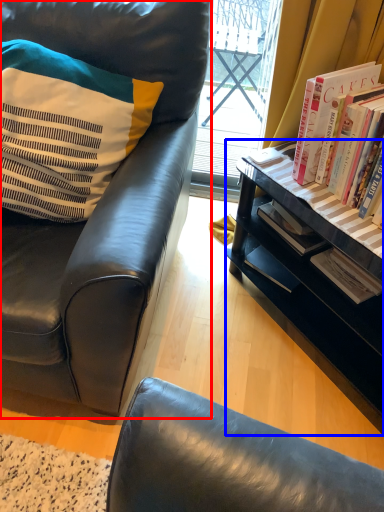
Question: Which object is further to the camera taking this photo, chair (highlighted by a red box) or desk (highlighted by a blue box)?

Choices:
 (A) chair
 (B) desk

Answer: (B)